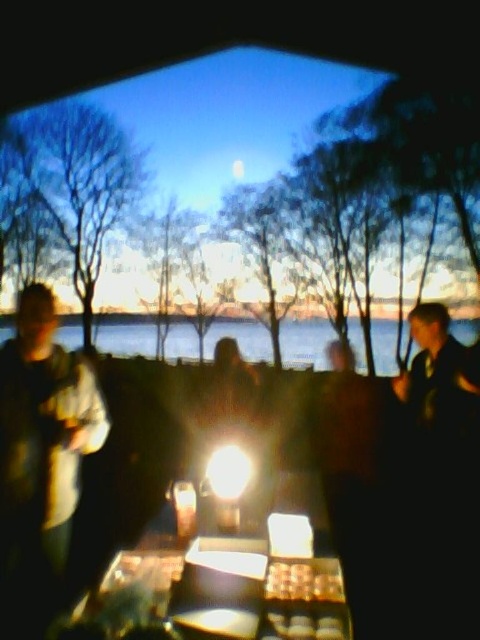
Question: Which point is farther from the camera taking this photo?

Choices:
 (A) (339, 580)
 (B) (179, 353)
 (C) (166, 609)
 (D) (431, 371)

Answer: (B)

Question: Can you confirm if clear water at center is smaller than dark blue shirt at right?

Choices:
 (A) yes
 (B) no

Answer: (B)

Question: In this image, where is dark blue shirt at right located relative to golden brown pastry at center?

Choices:
 (A) right
 (B) left

Answer: (A)

Question: Which point appears farthest from the camera in this image?

Choices:
 (A) [357, 349]
 (B) [333, 564]

Answer: (A)

Question: Estimate the real-world distances between objects in this image. Which object is farther from the golden brown pastry at center?

Choices:
 (A) shiny metallic table at center
 (B) clear water at center

Answer: (B)

Question: Is dark blue shirt at right bigger than golden brown pastry at center?

Choices:
 (A) yes
 (B) no

Answer: (A)